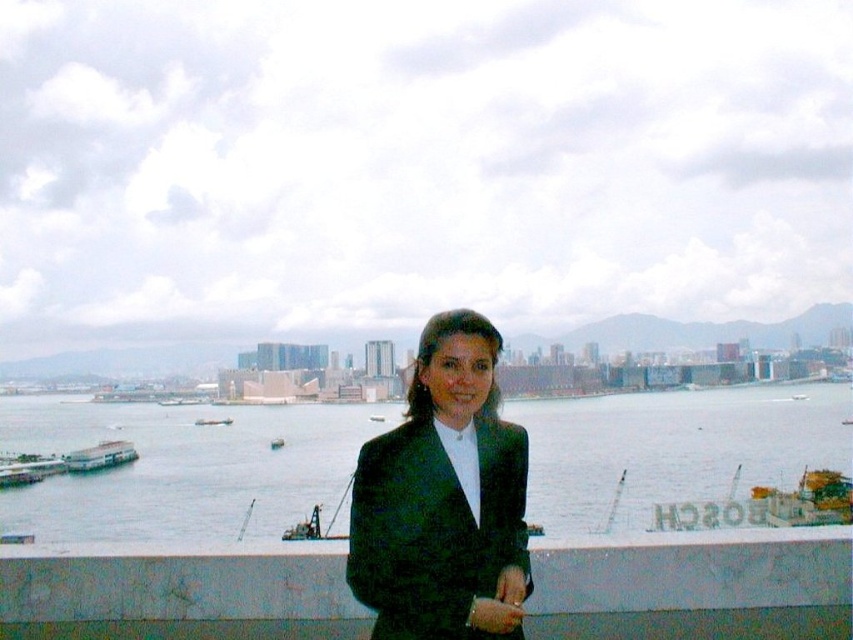
Question: Which object appears farthest from the camera in this image?

Choices:
 (A) teal plastic boat at center
 (B) black matte suit at center

Answer: (A)

Question: Among these points, which one is nearest to the camera?

Choices:
 (A) (193, 422)
 (B) (488, 625)
 (C) (274, 445)

Answer: (B)

Question: Where is metallic gray ship at center located in relation to teal plastic boat at center in the image?

Choices:
 (A) above
 (B) below

Answer: (A)

Question: Does white marble ledge at center have a larger size compared to teal plastic boat at center?

Choices:
 (A) no
 (B) yes

Answer: (B)

Question: Does metallic gray boat at lower left appear on the left side of metallic gray ship at center?

Choices:
 (A) yes
 (B) no

Answer: (A)

Question: Which of these objects is positioned farthest from the metallic gray ship at center?

Choices:
 (A) white marble ledge at center
 (B) metallic gray boat at lower left
 (C) teal plastic boat at center

Answer: (A)